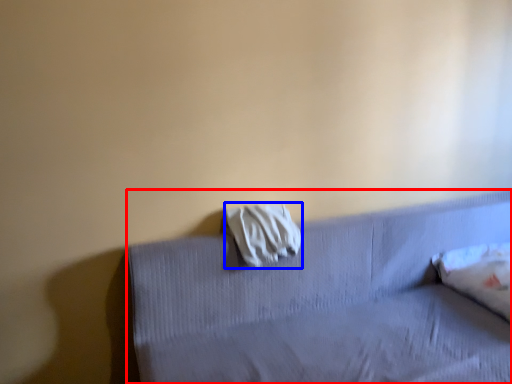
Question: Which of the following is the farthest to the observer, furniture (highlighted by a red box) or material (highlighted by a blue box)?

Choices:
 (A) furniture
 (B) material

Answer: (B)